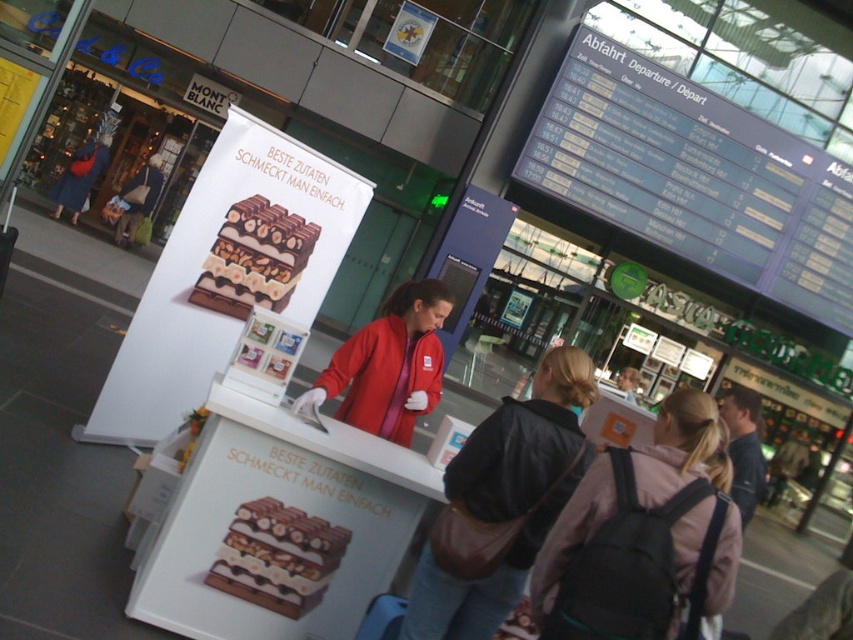
Question: Which object is the farthest from the matte chocolate cake at center?

Choices:
 (A) dark gray leather jacket at center
 (B) chocolatesmoothchocolate bar at center
 (C) matte red jacket at center

Answer: (B)

Question: Which of the following is the closest to the observer?

Choices:
 (A) (700, 552)
 (B) (251, 218)
 (C) (405, 627)

Answer: (A)

Question: Which point appears farthest from the camera in this image?

Choices:
 (A) (505, 436)
 (B) (202, 289)
 (C) (618, 557)

Answer: (B)

Question: Does matte chocolate cake at center appear over chocolatesmoothchocolate bar at center?

Choices:
 (A) no
 (B) yes

Answer: (A)

Question: Does matte chocolate cake at center have a lesser width compared to chocolatesmoothchocolate bar at center?

Choices:
 (A) no
 (B) yes

Answer: (B)

Question: Does dark gray leather jacket at center lie behind matte red jacket at center?

Choices:
 (A) no
 (B) yes

Answer: (A)